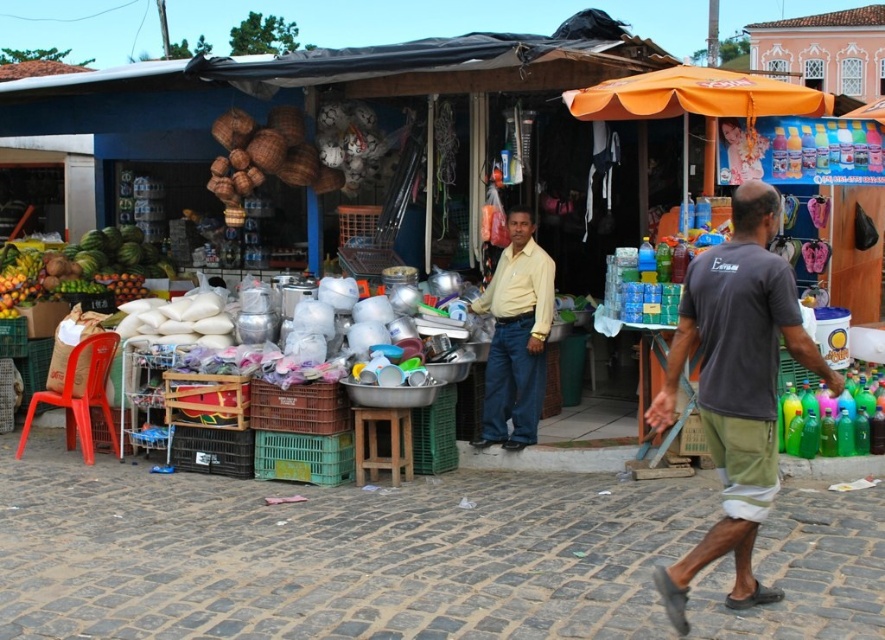
Which is behind, point (713, 330) or point (47, 252)?

Positioned behind is point (47, 252).

From the picture: Is dark gray t-shirt at center behind shiny green watermelon at left?

No, it is in front of shiny green watermelon at left.

Locate an element on the screen. The width and height of the screenshot is (885, 640). dark gray t-shirt at center is located at coordinates (736, 387).

I want to click on dark gray t-shirt at center, so click(x=736, y=387).

Does point (780, 330) come in front of point (532, 346)?

Yes, point (780, 330) is in front of point (532, 346).

Who is higher up, dark gray t-shirt at center or yellow matte shirt at center?

Positioned higher is yellow matte shirt at center.

Who is more forward, (753, 372) or (509, 440)?

Positioned in front is point (753, 372).

The width and height of the screenshot is (885, 640). Identify the location of dark gray t-shirt at center. (736, 387).

You are a GUI agent. You are given a task and a screenshot of the screen. Output one action in this format:
    pyautogui.click(x=<x>, y=<y>)
    Task: Click on the yellow matte shirt at center
    This screenshot has width=885, height=640.
    Given the screenshot: What is the action you would take?
    pyautogui.click(x=514, y=337)

This screenshot has width=885, height=640. What do you see at coordinates (514, 337) in the screenshot?
I see `yellow matte shirt at center` at bounding box center [514, 337].

Which is in front, point (526, 385) or point (119, 260)?

Point (526, 385)

The image size is (885, 640). In order to click on yellow matte shirt at center in this screenshot , I will do 514,337.